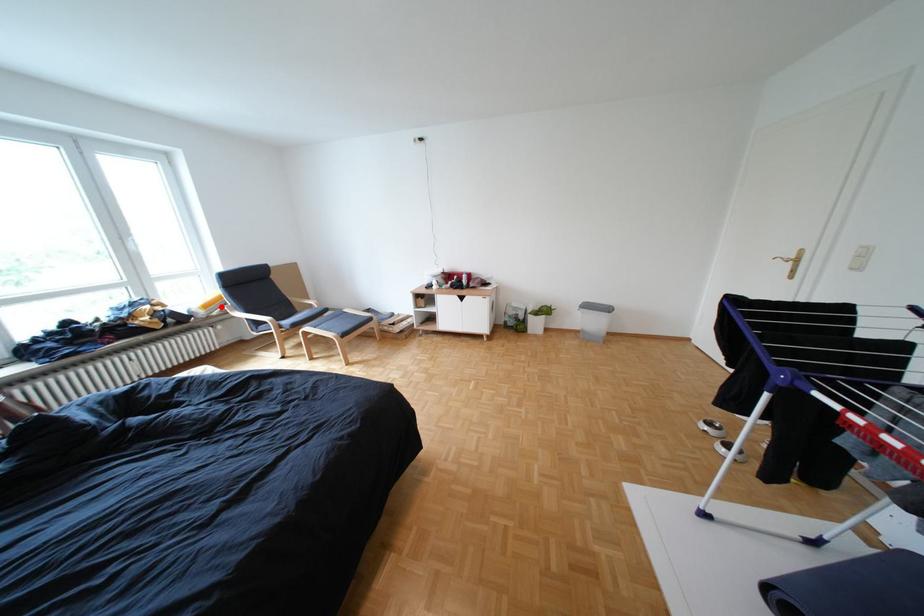
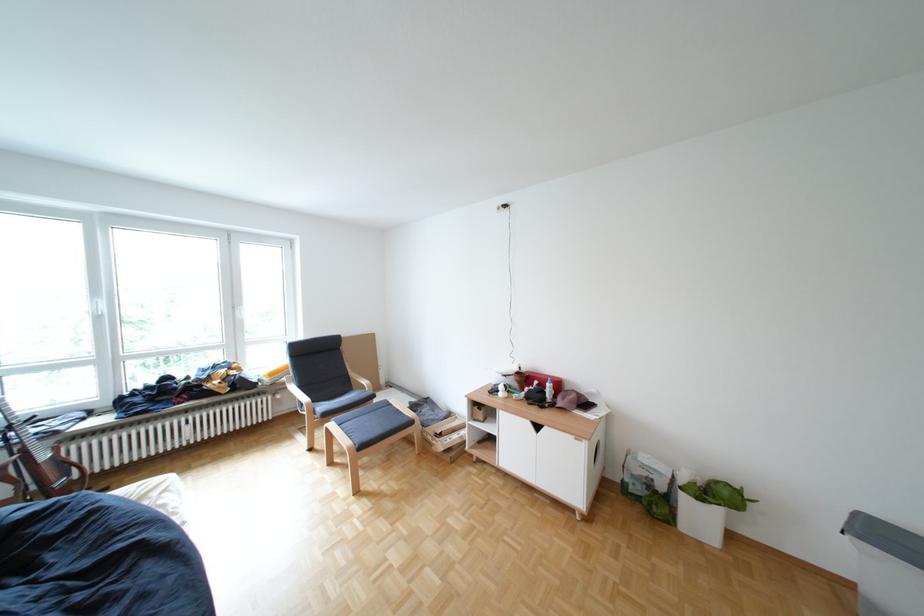
Find the pixel in the second image that matches the highlighted location in the first image.

(286, 374)